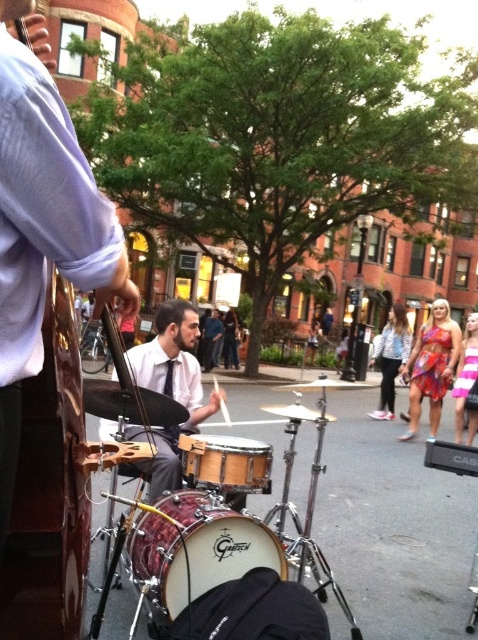
Based on the photo, who is more forward, (173,438) or (203,440)?

Positioned in front is point (203,440).

Is matte white shirt at center above wooden drum at center?

Indeed, matte white shirt at center is positioned over wooden drum at center.

Describe the element at coordinates (171, 387) in the screenshot. I see `matte white shirt at center` at that location.

Find the location of a particular element. The height and width of the screenshot is (640, 478). matte white shirt at center is located at coordinates (171, 387).

Is matte white shirt at center to the right of pink striped dress at lower right from the viewer's perspective?

In fact, matte white shirt at center is to the left of pink striped dress at lower right.

Between matte white shirt at center and pink striped dress at lower right, which one has less height?

Standing shorter between the two is matte white shirt at center.

The width and height of the screenshot is (478, 640). What do you see at coordinates (171, 387) in the screenshot?
I see `matte white shirt at center` at bounding box center [171, 387].

I want to click on matte white shirt at center, so click(x=171, y=387).

Which is behind, point (217, 456) or point (471, 410)?

The point (471, 410) is more distant.

In the scene shown: Does wooden drum at center have a lesser height compared to pink striped dress at lower right?

Indeed, wooden drum at center has a lesser height compared to pink striped dress at lower right.

Which is behind, point (252, 486) or point (466, 396)?

The point (466, 396) is more distant.

Where is `wooden drum at center`? The image size is (478, 640). wooden drum at center is located at coordinates (226, 461).